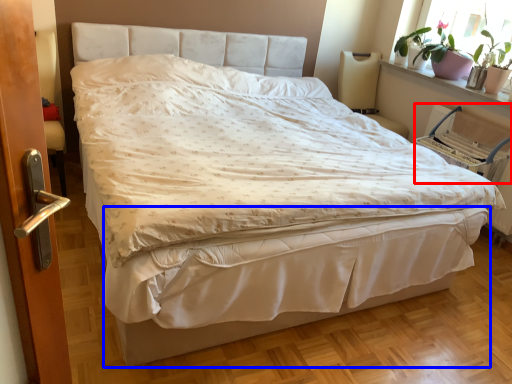
Question: Among these objects, which one is farthest to the camera, armchair (highlighted by a red box) or bed frame (highlighted by a blue box)?

Choices:
 (A) armchair
 (B) bed frame

Answer: (A)